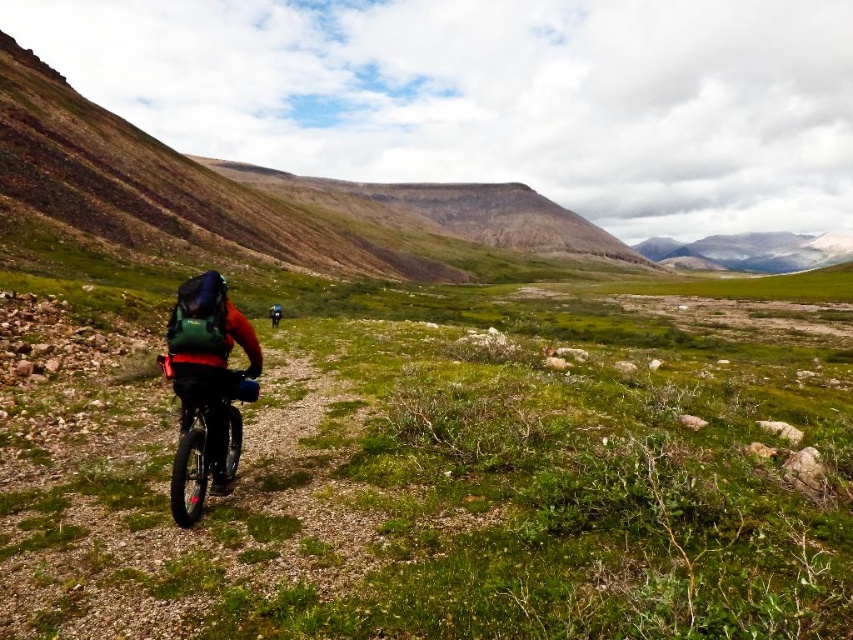
Question: Is green matte backpack at center behind shiny black frame at center?

Choices:
 (A) yes
 (B) no

Answer: (A)

Question: Which point is closer to the camera taking this photo?

Choices:
 (A) (254, 368)
 (B) (224, 435)

Answer: (B)

Question: Among these points, which one is nearest to the camera?

Choices:
 (A) (221, 486)
 (B) (200, 276)

Answer: (B)

Question: Can you confirm if green matte backpack at center is wider than shiny black frame at center?

Choices:
 (A) yes
 (B) no

Answer: (A)

Question: Is the position of green matte backpack at center less distant than that of shiny black frame at center?

Choices:
 (A) no
 (B) yes

Answer: (A)

Question: Which point is farther to the camera?

Choices:
 (A) shiny black frame at center
 (B) green matte backpack at center

Answer: (B)